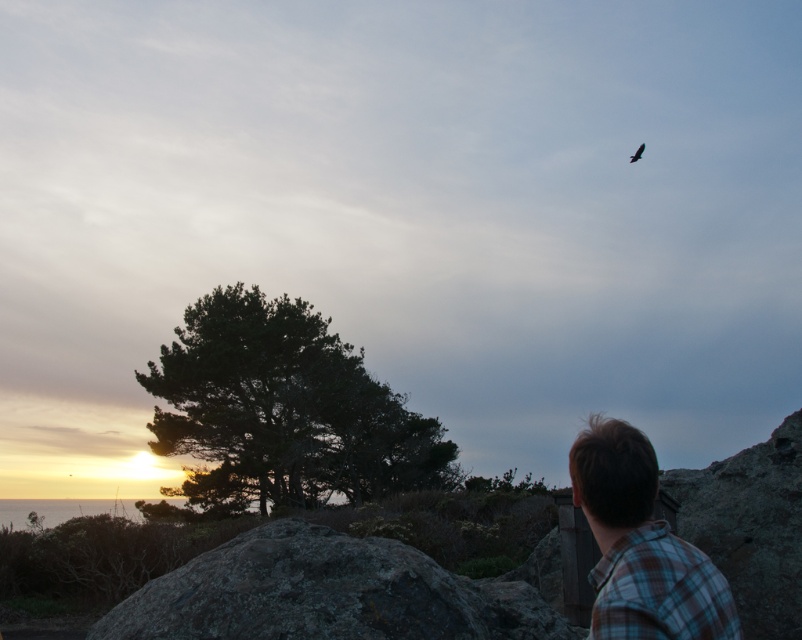
You are a hiker who wants to take a photo of the dark green textured tree at center left from the highest possible vantage point in the scene. Which direction should you move relative to your current position at point (282, 410)?

You should move towards the right side of the scene to get a higher vantage point for the dark green textured tree at center left.

You are standing at the point marked by the coordinates point (282, 410). Based on the scene, what object or feature is located at this position?

The dark green textured tree at center left is located at point (282, 410).